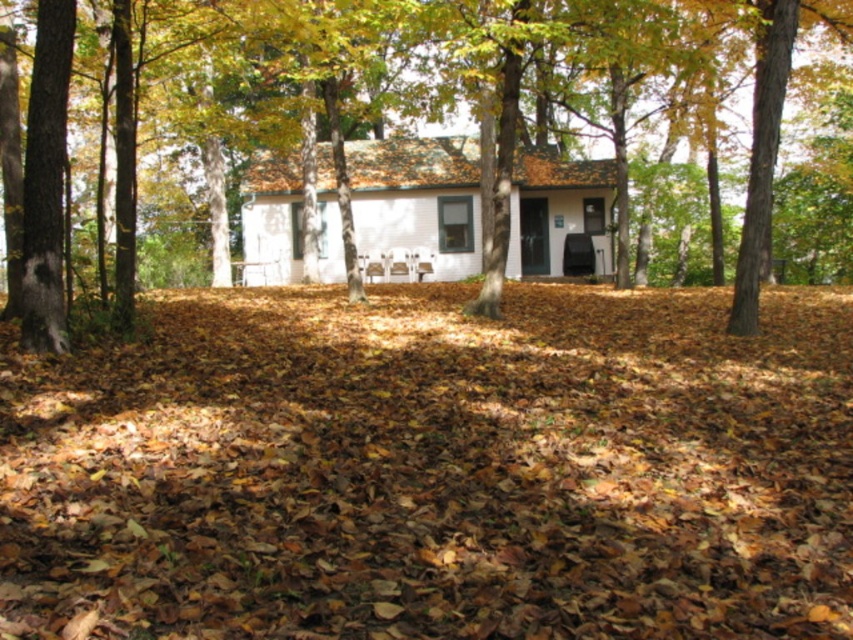
Which of these two, brown leaf litter at center or brown wood tree at center, stands taller?

brown wood tree at center is taller.

Where is `brown leaf litter at center`? This screenshot has width=853, height=640. brown leaf litter at center is located at coordinates (434, 468).

The width and height of the screenshot is (853, 640). I want to click on brown leaf litter at center, so click(x=434, y=468).